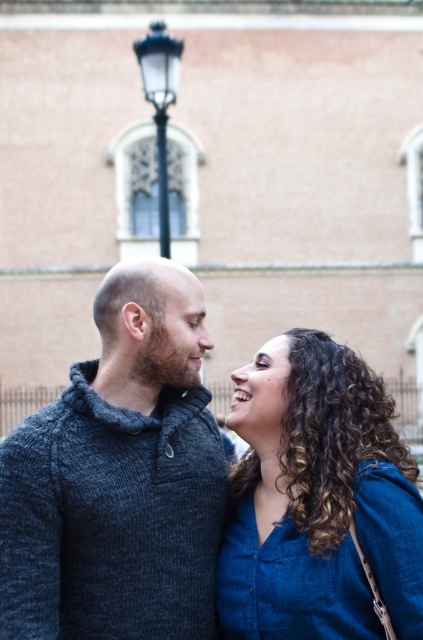
You are a photographer trying to capture a candid shot of the blue denim shirt at lower right and the black glass lamp post at upper center. Which object is closer to the camera?

The blue denim shirt at lower right is closer to the camera because it is in front of the black glass lamp post at upper center.

You are a photographer adjusting your camera settings to focus on the dark gray knitted sweater at center and the blue denim shirt at lower right. Which object should you focus on first to ensure both are in sharp focus?

The dark gray knitted sweater at center is closer to the viewer than the blue denim shirt at lower right, so you should focus on the dark gray knitted sweater at center first to ensure both are in sharp focus.